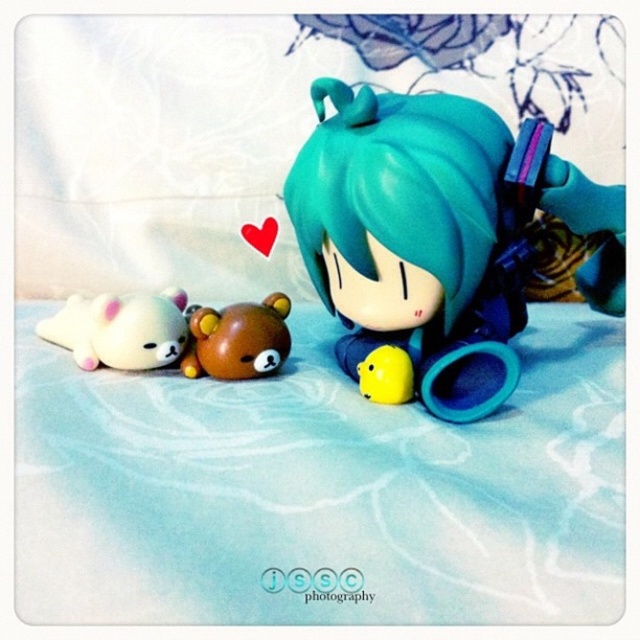
Looking at this image, you are organizing a shelf and want to place the white plush at left and the brown plush bear at center. If you have a shelf space that can only fit one of them, which one should you choose based on their widths?

The white plush at left is wider than the brown plush bear at center, so you should choose the white plush at left to fit on the shelf space.

From the picture: You are organizing a shelf and need to place the teal glossy figurine at center and the yellow matte plush at center. According to the scene, which object should be placed closer to the front of the shelf?

The teal glossy figurine at center should be placed closer to the front of the shelf because it is in front of the yellow matte plush at center in the scene.

You are a toy collector looking to arrange your collection. You have a teal glossy figurine at center and a brown plush bear at center. If you want to place a new toy between them, where should you position it?

The teal glossy figurine at center is above the brown plush bear at center, so you should place the new toy in between them vertically.